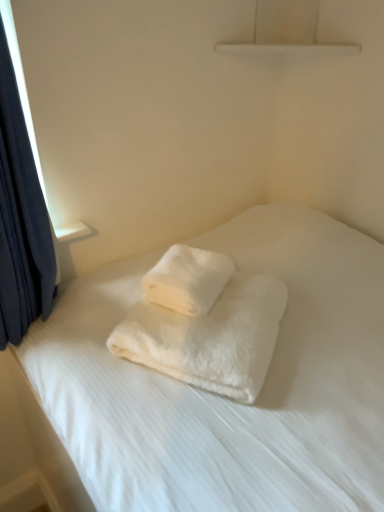
What do you see at coordinates (188, 279) in the screenshot?
I see `white fluffy towel at center, which is the 1th towel from top to bottom` at bounding box center [188, 279].

Measure the distance between white fluffy towels at center and camera.

A distance of 63.52 centimeters exists between white fluffy towels at center and camera.

What is the approximate height of white fluffy towels at center?

The height of white fluffy towels at center is 34.74 inches.

From the picture: Measure the distance between point (139,333) and camera.

A distance of 34.61 inches exists between point (139,333) and camera.

This screenshot has width=384, height=512. I want to click on white fluffy towel at center, which ranks as the 2th towel in bottom-to-top order, so click(188, 279).

Is white fluffy towel at center, which ranks as the 2th towel in bottom-to-top order, in front of or behind white fluffy towels at center in the image?

Clearly, white fluffy towel at center, which ranks as the 2th towel in bottom-to-top order, is behind white fluffy towels at center.

Where is `bed in front of the white fluffy towel at center, which is the 1th towel from top to bottom`? bed in front of the white fluffy towel at center, which is the 1th towel from top to bottom is located at coordinates (225, 398).

Is white fluffy towel at center, which ranks as the 2th towel in bottom-to-top order, taller than white fluffy towels at center?

In fact, white fluffy towel at center, which ranks as the 2th towel in bottom-to-top order, may be shorter than white fluffy towels at center.

Are white fluffy towel at center, which ranks as the 2th towel in bottom-to-top order, and white fluffy towels at center making contact?

No.

From a real-world perspective, who is located lower, white fluffy towels at center or white fluffy towel at center, the second towel when ordered from top to bottom?

white fluffy towels at center.

Between white fluffy towels at center and white fluffy towel at center, which is the first towel from bottom to top, which one has smaller size?

With smaller size is white fluffy towel at center, which is the first towel from bottom to top.

Does white fluffy towels at center have a lesser height compared to white fluffy towel at center, the second towel when ordered from top to bottom?

In fact, white fluffy towels at center may be taller than white fluffy towel at center, the second towel when ordered from top to bottom.

Would you say white fluffy towels at center is to the left or to the right of white fluffy towel at center, the second towel when ordered from top to bottom, in the picture?

From the image, it's evident that white fluffy towels at center is to the right of white fluffy towel at center, the second towel when ordered from top to bottom.

Is the position of white fluffy towel at center, which ranks as the 2th towel in bottom-to-top order, less distant than that of white fluffy towel at center, which is the first towel from bottom to top?

No, white fluffy towel at center, which ranks as the 2th towel in bottom-to-top order, is behind white fluffy towel at center, which is the first towel from bottom to top.

The height and width of the screenshot is (512, 384). I want to click on towel above the white fluffy towel at center, which is the first towel from bottom to top (from a real-world perspective), so point(188,279).

Which of these two, white fluffy towel at center, which is the 1th towel from top to bottom, or white fluffy towel at center, which is the first towel from bottom to top, is thinner?

white fluffy towel at center, which is the 1th towel from top to bottom.

Does white fluffy towels at center have a larger size compared to white fluffy towel at center, which is the 1th towel from top to bottom?

Yes.

You are a GUI agent. You are given a task and a screenshot of the screen. Output one action in this format:
    pyautogui.click(x=<x>, y=<y>)
    Task: Click on the 2nd towel behind the white fluffy towels at center, starting your count from the anchor
    
    Given the screenshot: What is the action you would take?
    pyautogui.click(x=188, y=279)

Would you say white fluffy towels at center is to the left or to the right of white fluffy towel at center, which is the 1th towel from top to bottom, in the picture?

white fluffy towels at center is to the right of white fluffy towel at center, which is the 1th towel from top to bottom.

Considering the sizes of objects white fluffy towel at center, which is the first towel from bottom to top, and white fluffy towel at center, which is the 1th towel from top to bottom, in the image provided, who is taller, white fluffy towel at center, which is the first towel from bottom to top, or white fluffy towel at center, which is the 1th towel from top to bottom,?

white fluffy towel at center, which is the first towel from bottom to top.

From a real-world perspective, which object rests below the other?

white fluffy towel at center, the second towel when ordered from top to bottom, is physically lower.

Identify the location of towel on the right of white fluffy towel at center, which is the 1th towel from top to bottom. (210, 337).

Is white fluffy towel at center, the second towel when ordered from top to bottom, in contact with white fluffy towel at center, which ranks as the 2th towel in bottom-to-top order?

Yes, the surface of white fluffy towel at center, the second towel when ordered from top to bottom, is in contact with white fluffy towel at center, which ranks as the 2th towel in bottom-to-top order.

Is white fluffy towels at center inside white fluffy towel at center, the second towel when ordered from top to bottom?

No.

This screenshot has width=384, height=512. In order to click on bed in front of the white fluffy towel at center, which is the first towel from bottom to top in this screenshot , I will do (225, 398).

Is white fluffy towel at center, the second towel when ordered from top to bottom, not close to white fluffy towels at center?

No, there isn't a large distance between white fluffy towel at center, the second towel when ordered from top to bottom, and white fluffy towels at center.

Identify the location of bed located on the right of white fluffy towel at center, which is the 1th towel from top to bottom. The height and width of the screenshot is (512, 384). pos(225,398).

In the image, there is a white fluffy towel at center, which is the first towel from bottom to top. Find the location of `bed below it (from a real-world perspective)`. bed below it (from a real-world perspective) is located at coordinates (225, 398).

Which object lies nearer to the anchor point white fluffy towel at center, which is the first towel from bottom to top, white fluffy towels at center or white fluffy towel at center, which is the 1th towel from top to bottom?

The object closer to white fluffy towel at center, which is the first towel from bottom to top, is white fluffy towel at center, which is the 1th towel from top to bottom.

Looking at the image, which one is located further to white fluffy towels at center, white fluffy towel at center, which is the first towel from bottom to top, or white fluffy towel at center, which is the 1th towel from top to bottom?

Among the two, white fluffy towel at center, which is the 1th towel from top to bottom, is located further to white fluffy towels at center.

When comparing their distances from white fluffy towels at center, does white fluffy towel at center, which is the 1th towel from top to bottom, or white fluffy towel at center, the second towel when ordered from top to bottom, seem further?

white fluffy towel at center, which is the 1th towel from top to bottom, lies further to white fluffy towels at center than the other object.

Based on their spatial positions, is white fluffy towels at center or white fluffy towel at center, which is the first towel from bottom to top, further from white fluffy towel at center, which is the 1th towel from top to bottom?

Among the two, white fluffy towels at center is located further to white fluffy towel at center, which is the 1th towel from top to bottom.

When comparing their distances from white fluffy towel at center, which ranks as the 2th towel in bottom-to-top order, does white fluffy towel at center, which is the first towel from bottom to top, or white fluffy towels at center seem closer?

white fluffy towel at center, which is the first towel from bottom to top, is closer to white fluffy towel at center, which ranks as the 2th towel in bottom-to-top order.

Looking at the image, which one is located further to white fluffy towel at center, which is the first towel from bottom to top, white fluffy towel at center, which is the 1th towel from top to bottom, or white fluffy towels at center?

white fluffy towels at center lies further to white fluffy towel at center, which is the first towel from bottom to top, than the other object.

The width and height of the screenshot is (384, 512). Identify the location of towel located between white fluffy towels at center and white fluffy towel at center, which is the 1th towel from top to bottom, in the depth direction. (210, 337).